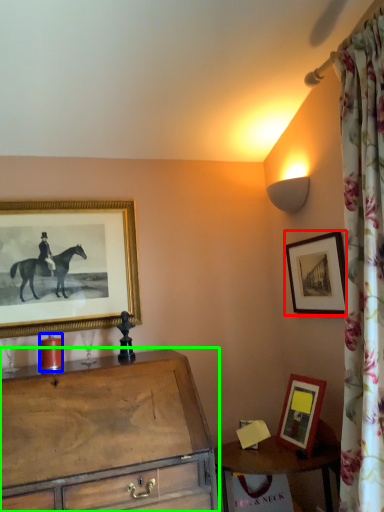
Question: Which object is positioned closest to picture frame (highlighted by a red box)? Select from candle holder (highlighted by a blue box) and chest of drawers (highlighted by a green box).

Choices:
 (A) candle holder
 (B) chest of drawers

Answer: (B)